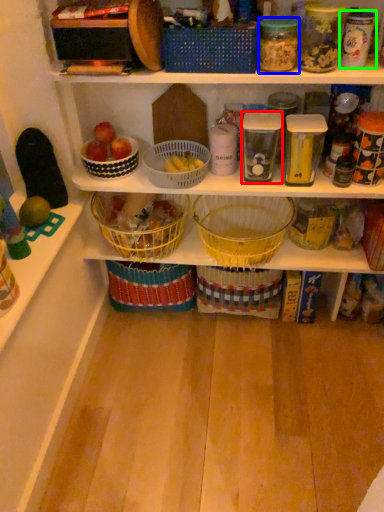
Question: Which is nearer to the glass jar (highlighted by a red box)? glass jar (highlighted by a blue box) or glass jar (highlighted by a green box).

Choices:
 (A) glass jar
 (B) glass jar

Answer: (A)